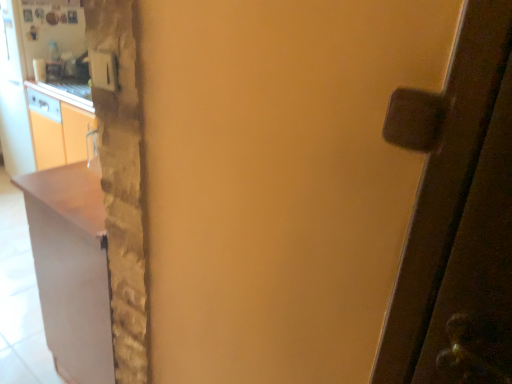
At what (x,y) coordinates should I click in order to perform the action: click on matte white cabinet at left. Please return your answer as a coordinate pair (x, y). Looking at the image, I should click on (71, 269).

The width and height of the screenshot is (512, 384). What do you see at coordinates (71, 269) in the screenshot? I see `matte white cabinet at left` at bounding box center [71, 269].

Locate an element on the screen. The height and width of the screenshot is (384, 512). matte white cabinet at left is located at coordinates (71, 269).